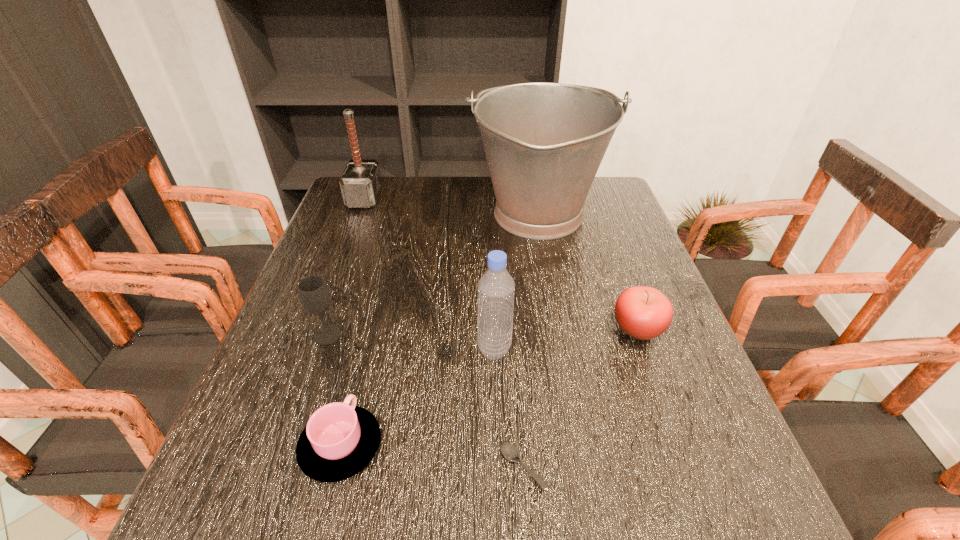
I want to click on vacant space at the left edge, so click(x=318, y=363).

This screenshot has height=540, width=960. I want to click on vacant space at the right edge of the desktop, so coord(605,224).

Where is `free space at the far left corner`? This screenshot has height=540, width=960. free space at the far left corner is located at coordinates (389, 195).

Where is `vacant region at the far right corner of the desktop`? vacant region at the far right corner of the desktop is located at coordinates pos(587,205).

I want to click on vacant point located between the second shortest object and the bucket, so click(440, 331).

Where is `free space between the bottle and the hammer`? This screenshot has height=540, width=960. free space between the bottle and the hammer is located at coordinates (429, 274).

At what (x,y) coordinates should I click in order to perform the action: click on free space between the soupspoon and the cup. Please return your answer as a coordinate pair (x, y). The height and width of the screenshot is (540, 960). Looking at the image, I should click on (432, 457).

This screenshot has height=540, width=960. In order to click on vacant area that lies between the fourth shortest object and the bottle in this screenshot , I will do `click(411, 342)`.

Where is `free spot between the tallest object and the wineglass`? free spot between the tallest object and the wineglass is located at coordinates (433, 275).

The image size is (960, 540). I want to click on vacant area that lies between the cup and the apple, so click(490, 387).